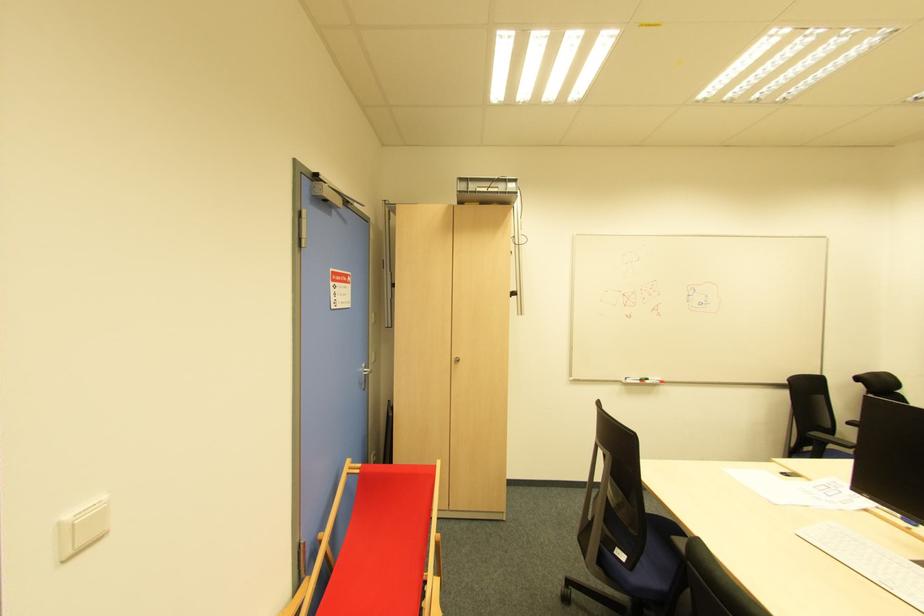
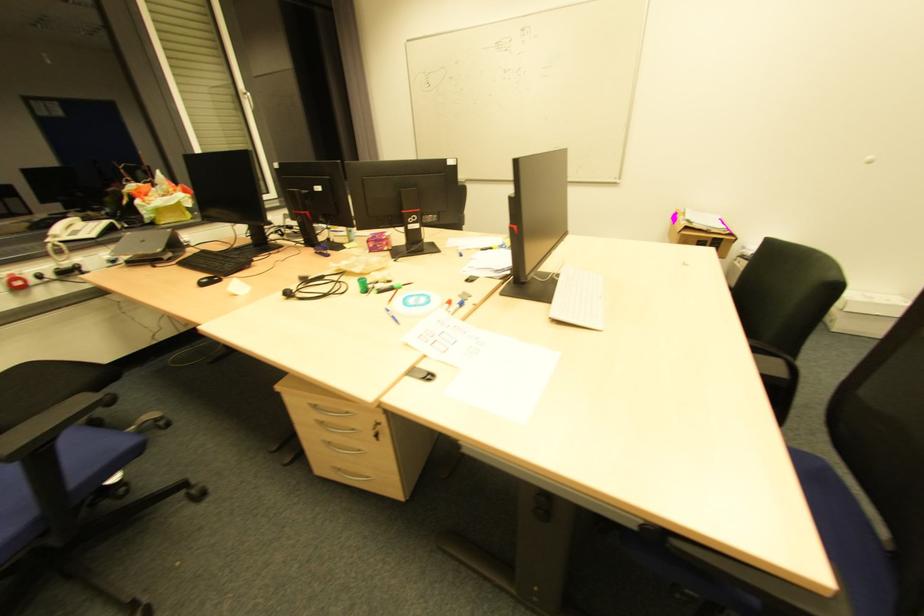
Find the pixel in the second image that matches [825,445] in the first image.

(51, 440)